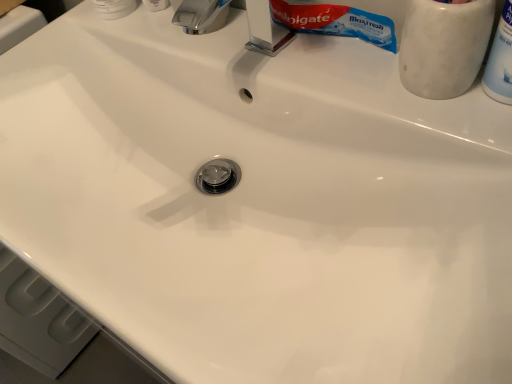
This screenshot has width=512, height=384. In order to click on vacant space in front of white marble toothbrush holder at upper right, acting as the second toiletry starting from the left in this screenshot , I will do `click(460, 172)`.